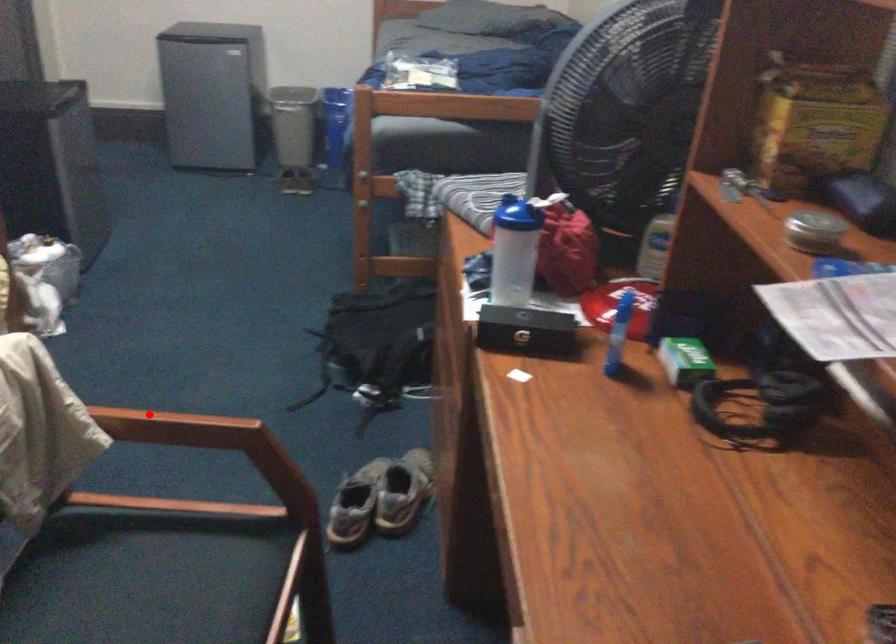
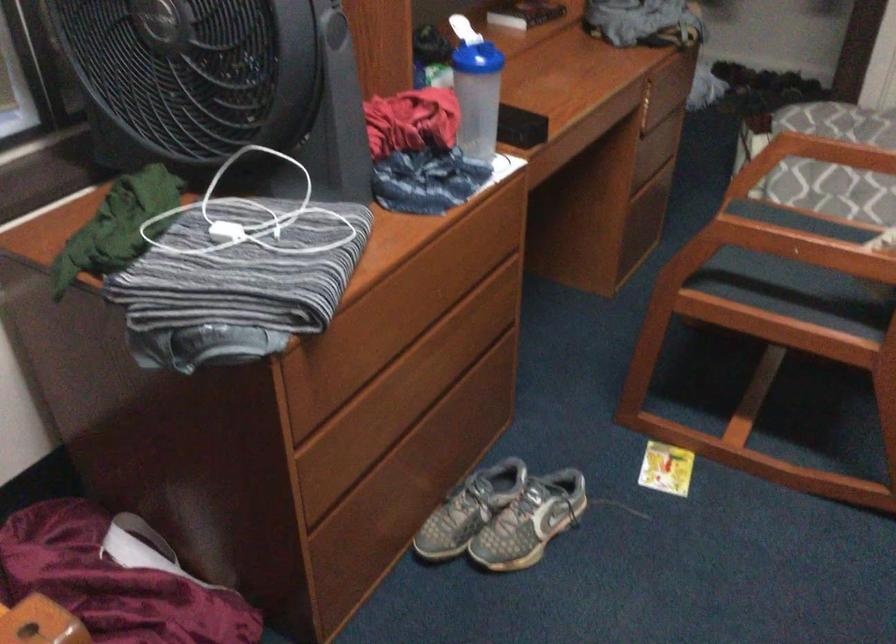
Find the pixel in the second image that matches the highlighted location in the first image.

(826, 234)